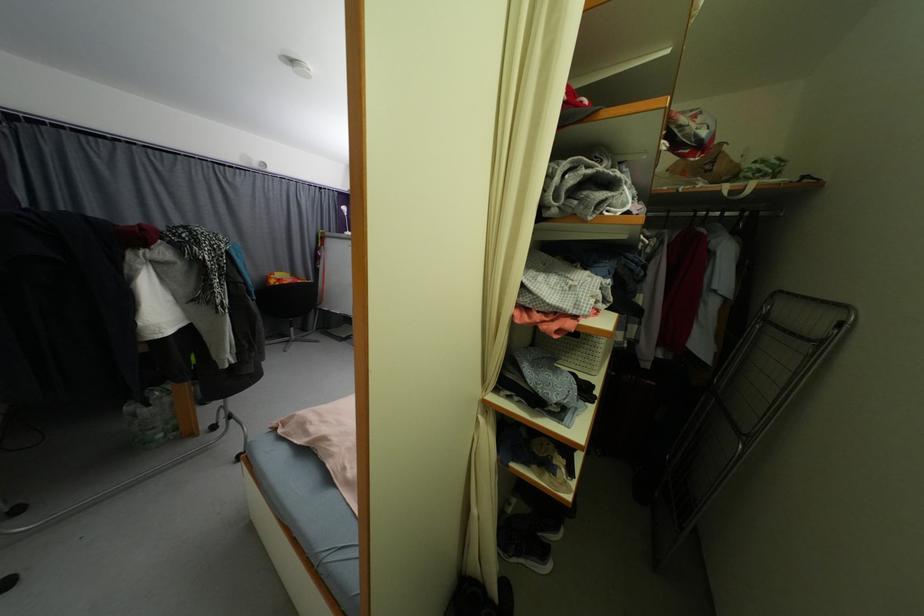
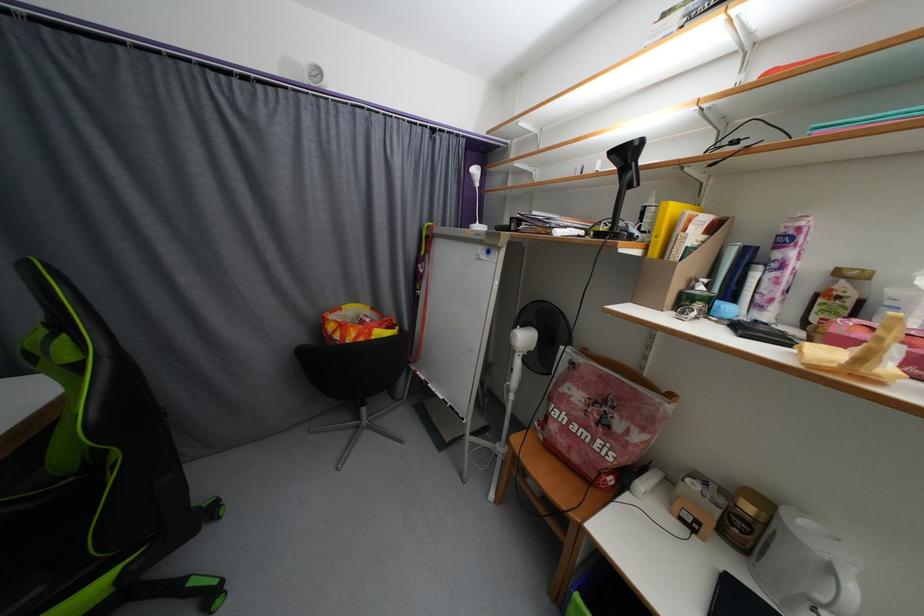
The images are taken continuously from a first-person perspective. In which direction are you moving?

The movement direction of the cameraman is left, forward.